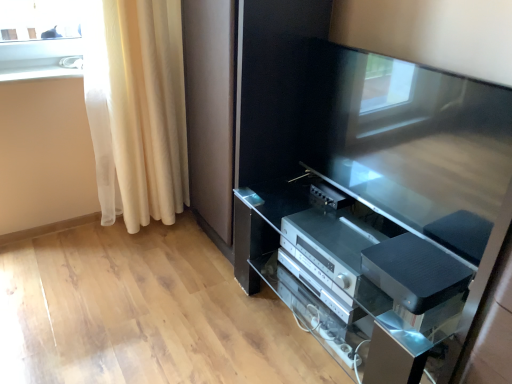
The height and width of the screenshot is (384, 512). What do you see at coordinates (38, 73) in the screenshot? I see `white glossy window sill at upper left` at bounding box center [38, 73].

What is the approximate width of satin black tv cabinet at center?

24.93 inches.

I want to click on silver metallic stereo at lower center, the first appliance viewed from the back, so click(329, 245).

Where is `satin black tv at center`? satin black tv at center is located at coordinates (369, 192).

Locate an element on the screen. The image size is (512, 384). white glossy window sill at upper left is located at coordinates (38, 73).

Does satin black tv at center appear on the left side of satin black tv cabinet at center?

Incorrect, satin black tv at center is not on the left side of satin black tv cabinet at center.

How many degrees apart are the facing directions of satin black tv at center and satin black tv cabinet at center?

They differ by 4.03 degrees in their facing directions.

Is satin black tv at center positioned with its back to satin black tv cabinet at center?

No, satin black tv at center's orientation is not away from satin black tv cabinet at center.

Is white sheer curtain at left facing away from satin black tv at center?

white sheer curtain at left is not turned away from satin black tv at center.

Looking at this image, which is more distant, (144, 5) or (327, 53)?

The point (144, 5) is behind.

Can you confirm if white sheer curtain at left is thinner than satin black tv at center?

Incorrect, the width of white sheer curtain at left is not less than that of satin black tv at center.

Considering the sizes of white sheer curtain at left and satin black tv at center in the image, is white sheer curtain at left bigger or smaller than satin black tv at center?

Considering their sizes, white sheer curtain at left takes up more space than satin black tv at center.

From the image's perspective, is silver metallic stereo at lower center, the first appliance viewed from the back, positioned above or below white sheer curtain at left?

From the image's perspective, silver metallic stereo at lower center, the first appliance viewed from the back, appears below white sheer curtain at left.

How different are the orientations of silver metallic stereo at lower center, which is counted as the second appliance, starting from the front, and white sheer curtain at left in degrees?

87.8 degrees separate the facing orientations of silver metallic stereo at lower center, which is counted as the second appliance, starting from the front, and white sheer curtain at left.

Is silver metallic stereo at lower center, which is counted as the second appliance, starting from the front, spatially inside white sheer curtain at left, or outside of it?

silver metallic stereo at lower center, which is counted as the second appliance, starting from the front, cannot be found inside white sheer curtain at left.

Does silver metallic stereo at lower center, the first appliance viewed from the back, have a larger size compared to white sheer curtain at left?

No.

Can you tell me how much black textured speaker at lower right, placed as the second appliance when sorted from back to front, and white glossy window sill at upper left differ in facing direction?

The angular difference between black textured speaker at lower right, placed as the second appliance when sorted from back to front, and white glossy window sill at upper left is 89.2 degrees.

Is black textured speaker at lower right, placed as the second appliance when sorted from back to front, next to white glossy window sill at upper left?

black textured speaker at lower right, placed as the second appliance when sorted from back to front, and white glossy window sill at upper left are clearly separated.

Between black textured speaker at lower right, the 1th appliance when ordered from front to back, and white glossy window sill at upper left, which one has larger size?

black textured speaker at lower right, the 1th appliance when ordered from front to back.

Considering the sizes of objects black textured speaker at lower right, placed as the second appliance when sorted from back to front, and white glossy window sill at upper left in the image provided, who is wider, black textured speaker at lower right, placed as the second appliance when sorted from back to front, or white glossy window sill at upper left?

With larger width is black textured speaker at lower right, placed as the second appliance when sorted from back to front.

From the image's perspective, is black textured speaker at lower right, the 1th appliance when ordered from front to back, beneath white sheer curtain at left?

Yes, from the image's perspective, black textured speaker at lower right, the 1th appliance when ordered from front to back, is below white sheer curtain at left.

The image size is (512, 384). What are the coordinates of `curtain located above the black textured speaker at lower right, the 1th appliance when ordered from front to back (from the image's perspective)` in the screenshot? It's located at (137, 108).

Is white sheer curtain at left at the back of black textured speaker at lower right, the 1th appliance when ordered from front to back?

No, black textured speaker at lower right, the 1th appliance when ordered from front to back, is not facing the opposite direction of white sheer curtain at left.

Which object is positioned more to the right, white sheer curtain at left or black textured speaker at lower right, the 1th appliance when ordered from front to back?

Positioned to the right is black textured speaker at lower right, the 1th appliance when ordered from front to back.

From a real-world perspective, between white sheer curtain at left and black textured speaker at lower right, the 1th appliance when ordered from front to back, who is vertically lower?

black textured speaker at lower right, the 1th appliance when ordered from front to back, from a real-world perspective.

Can you see white sheer curtain at left touching black textured speaker at lower right, placed as the second appliance when sorted from back to front?

No, white sheer curtain at left is not beside black textured speaker at lower right, placed as the second appliance when sorted from back to front.

Is black textured speaker at lower right, the 1th appliance when ordered from front to back, at the back of white sheer curtain at left?

white sheer curtain at left is not turned away from black textured speaker at lower right, the 1th appliance when ordered from front to back.

Does white glossy window sill at upper left have a smaller size compared to silver metallic stereo at lower center, the first appliance viewed from the back?

Indeed, white glossy window sill at upper left has a smaller size compared to silver metallic stereo at lower center, the first appliance viewed from the back.

Which of these two, white glossy window sill at upper left or silver metallic stereo at lower center, which is counted as the second appliance, starting from the front, stands shorter?

white glossy window sill at upper left is shorter.

From a real-world perspective, is white glossy window sill at upper left positioned under silver metallic stereo at lower center, which is counted as the second appliance, starting from the front, based on gravity?

No.

Is point (39, 69) positioned behind point (339, 232)?

That is True.

Where is `tv cabinet below the satin black tv at center (from the image's perspective)`? The image size is (512, 384). tv cabinet below the satin black tv at center (from the image's perspective) is located at coordinates (350, 277).

Locate an element on the screen. The width and height of the screenshot is (512, 384). furniture that appears on the right of white sheer curtain at left is located at coordinates (369, 192).

From the image, which object appears to be farther from white sheer curtain at left, white glossy window sill at upper left or black textured speaker at lower right, the 1th appliance when ordered from front to back?

Among the two, black textured speaker at lower right, the 1th appliance when ordered from front to back, is located further to white sheer curtain at left.

In the scene shown: Considering their positions, is white sheer curtain at left positioned further to black textured speaker at lower right, the 1th appliance when ordered from front to back, than satin black tv at center?

The object further to black textured speaker at lower right, the 1th appliance when ordered from front to back, is white sheer curtain at left.

Which object lies further to the anchor point satin black tv at center, white sheer curtain at left or satin black tv cabinet at center?

white sheer curtain at left is positioned further to the anchor satin black tv at center.

Looking at the image, which one is located closer to satin black tv at center, black textured speaker at lower right, placed as the second appliance when sorted from back to front, or satin black tv cabinet at center?

Based on the image, satin black tv cabinet at center appears to be nearer to satin black tv at center.

Based on their spatial positions, is black textured speaker at lower right, the 1th appliance when ordered from front to back, or satin black tv cabinet at center further from silver metallic stereo at lower center, which is counted as the second appliance, starting from the front?

black textured speaker at lower right, the 1th appliance when ordered from front to back, is positioned further to the anchor silver metallic stereo at lower center, which is counted as the second appliance, starting from the front.

Looking at the image, which one is located closer to satin black tv cabinet at center, white sheer curtain at left or silver metallic stereo at lower center, the first appliance viewed from the back?

silver metallic stereo at lower center, the first appliance viewed from the back.

Which object lies further to the anchor point silver metallic stereo at lower center, which is counted as the second appliance, starting from the front, satin black tv at center or satin black tv cabinet at center?

satin black tv at center is further to silver metallic stereo at lower center, which is counted as the second appliance, starting from the front.

Based on their spatial positions, is satin black tv cabinet at center or white glossy window sill at upper left closer to black textured speaker at lower right, placed as the second appliance when sorted from back to front?

satin black tv cabinet at center is closer to black textured speaker at lower right, placed as the second appliance when sorted from back to front.

Identify the location of curtain located between white glossy window sill at upper left and satin black tv at center in the left-right direction. The width and height of the screenshot is (512, 384). (137, 108).

The image size is (512, 384). I want to click on tv cabinet situated between white sheer curtain at left and satin black tv at center from left to right, so click(350, 277).

This screenshot has width=512, height=384. What are the coordinates of `tv cabinet situated between white sheer curtain at left and black textured speaker at lower right, the 1th appliance when ordered from front to back, from left to right` in the screenshot? It's located at (350, 277).

Where is `tv cabinet between white glossy window sill at upper left and satin black tv at center from left to right`? The height and width of the screenshot is (384, 512). tv cabinet between white glossy window sill at upper left and satin black tv at center from left to right is located at coordinates (350, 277).